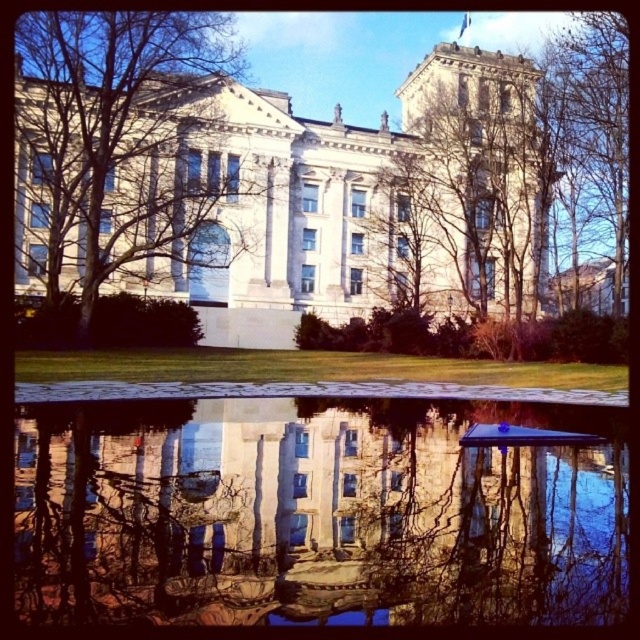
Question: Among these points, which one is nearest to the camera?

Choices:
 (A) (595, 515)
 (B) (388, 193)
 (C) (64, 204)
 (D) (564, 205)

Answer: (A)

Question: Can you confirm if transparent glass water at center is wider than bare branches at upper center?

Choices:
 (A) no
 (B) yes

Answer: (B)

Question: Can you confirm if transparent glass water at center is smaller than bare branches at upper right?

Choices:
 (A) yes
 (B) no

Answer: (A)

Question: Which of the following is the closest to the observer?

Choices:
 (A) bare branches at left
 (B) bare branches at upper center
 (C) transparent glass water at center
 (D) bare branches at upper right

Answer: (C)

Question: Among these objects, which one is farthest from the camera?

Choices:
 (A) transparent glass water at center
 (B) bare branches at left
 (C) bare branches at upper center

Answer: (C)

Question: Can you confirm if bare branches at upper center is thinner than bare branches at upper right?

Choices:
 (A) no
 (B) yes

Answer: (A)